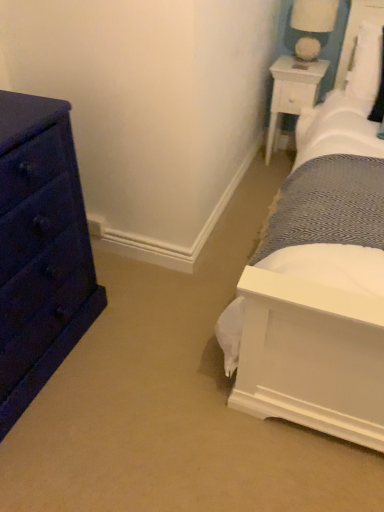
Question: Considering the positions of white fabric-covered lampshade at upper right and white wood nightstand at upper right in the image, is white fabric-covered lampshade at upper right taller or shorter than white wood nightstand at upper right?

Choices:
 (A) short
 (B) tall

Answer: (A)

Question: Looking at their shapes, would you say white fabric-covered lampshade at upper right is wider or thinner than white wood nightstand at upper right?

Choices:
 (A) wide
 (B) thin

Answer: (B)

Question: Based on their relative distances, which object is farther from the white wood nightstand at upper right?

Choices:
 (A) matte dark blue dresser at left
 (B) white fabric-covered lampshade at upper right

Answer: (A)

Question: Estimate the real-world distances between objects in this image. Which object is closer to the white wood nightstand at upper right?

Choices:
 (A) matte dark blue dresser at left
 (B) white fabric-covered lampshade at upper right

Answer: (B)